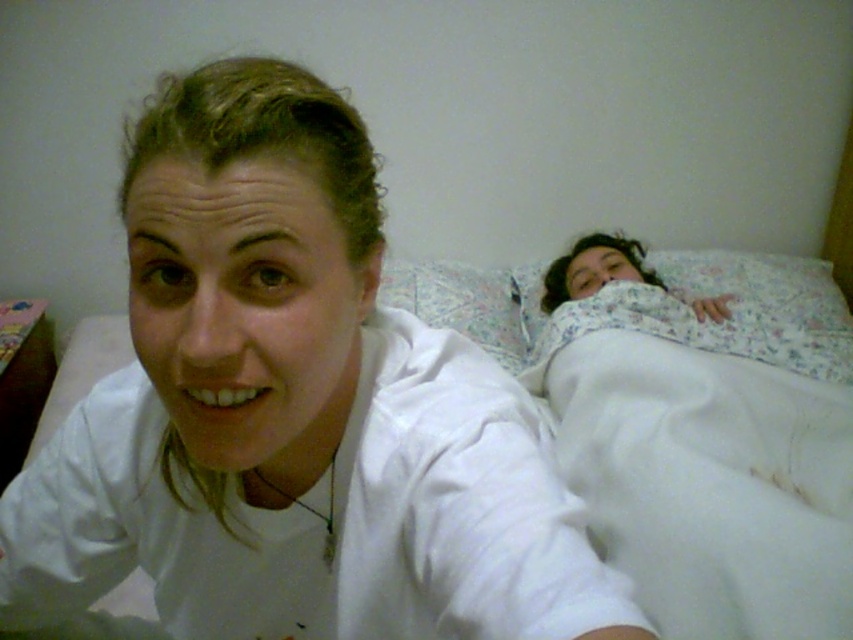
Which is behind, point (223, 195) or point (544, 307)?

The point (544, 307) is behind.

Which is above, white matte shirt at center or white soft fabric at upper right?

Positioned higher is white soft fabric at upper right.

Is point (193, 404) in front of point (642, 269)?

Yes, point (193, 404) is in front of point (642, 269).

The height and width of the screenshot is (640, 853). In order to click on white matte shirt at center in this screenshot , I will do `click(293, 412)`.